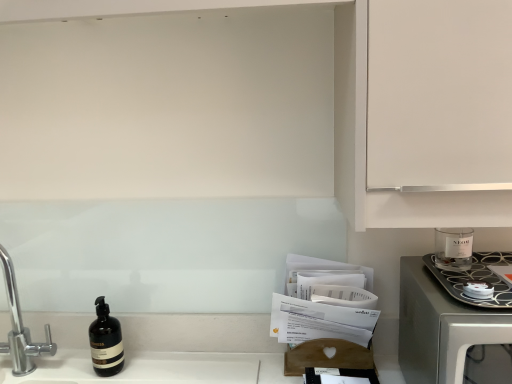
This screenshot has width=512, height=384. Find the location of `free space above satin silver microwave at right (from a real-world perspective)`. free space above satin silver microwave at right (from a real-world perspective) is located at coordinates (463, 275).